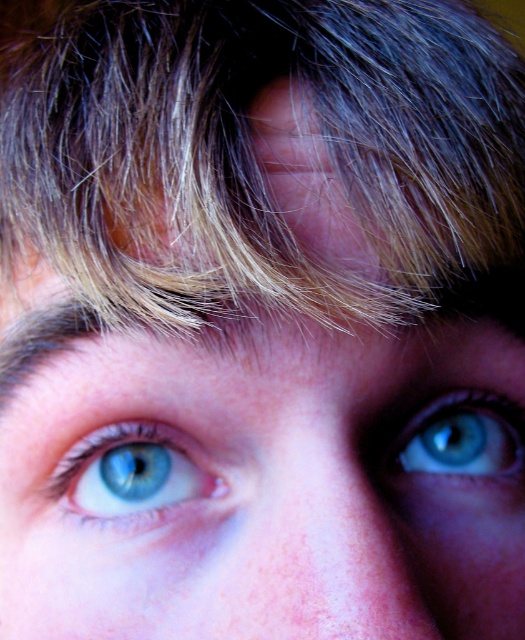
Question: Which object is closer to the camera taking this photo?

Choices:
 (A) blonde hair at upper center
 (B) blue glossy eye at center
 (C) blue glossy eye at upper right

Answer: (A)

Question: Can you confirm if blue glossy eye at center is smaller than blue glossy eye at upper right?

Choices:
 (A) no
 (B) yes

Answer: (B)

Question: Which is farther from the blue glossy eye at center?

Choices:
 (A) blonde hair at upper center
 (B) blue glossy eye at upper right

Answer: (A)

Question: Is blonde hair at upper center positioned before blue glossy eye at center?

Choices:
 (A) no
 (B) yes

Answer: (B)

Question: In this image, where is blonde hair at upper center located relative to blue glossy eye at upper right?

Choices:
 (A) left
 (B) right

Answer: (A)

Question: Based on their relative distances, which object is nearer to the blue glossy eye at center?

Choices:
 (A) blonde hair at upper center
 (B) blue glossy eye at upper right

Answer: (B)